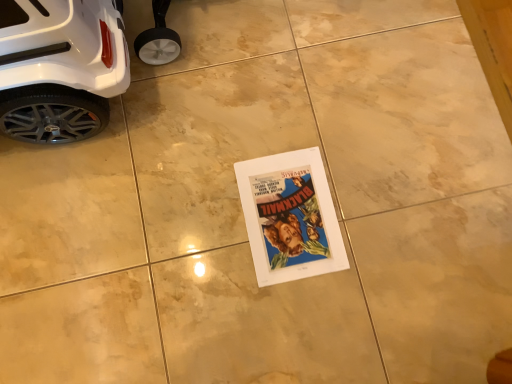
Find the location of a particular element. vacant region under vibrant paper movie poster at center (from a real-world perspective) is located at coordinates pos(289,213).